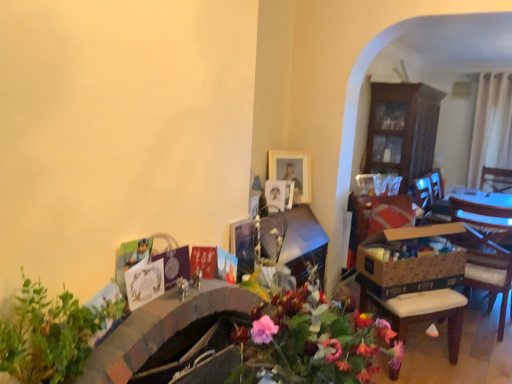
Question: Choose the correct answer: Is wooden picture frame at upper center inside wooden chair at right or outside it?

Choices:
 (A) inside
 (B) outside

Answer: (B)

Question: Is point (309, 160) closer or farther from the camera than point (489, 238)?

Choices:
 (A) closer
 (B) farther

Answer: (A)

Question: Estimate the real-world distances between objects in this image. Which object is closer to the wooden cabinet at right?

Choices:
 (A) wooden picture frame at upper center
 (B) green leafy plant at lower left
 (C) brown cardboard box at right
 (D) wooden chair at right

Answer: (D)

Question: Based on their relative distances, which object is nearer to the wooden picture frame at upper center?

Choices:
 (A) brown cardboard box at right
 (B) green leafy plant at lower left
 (C) wooden cabinet at right
 (D) wooden chair at right

Answer: (A)